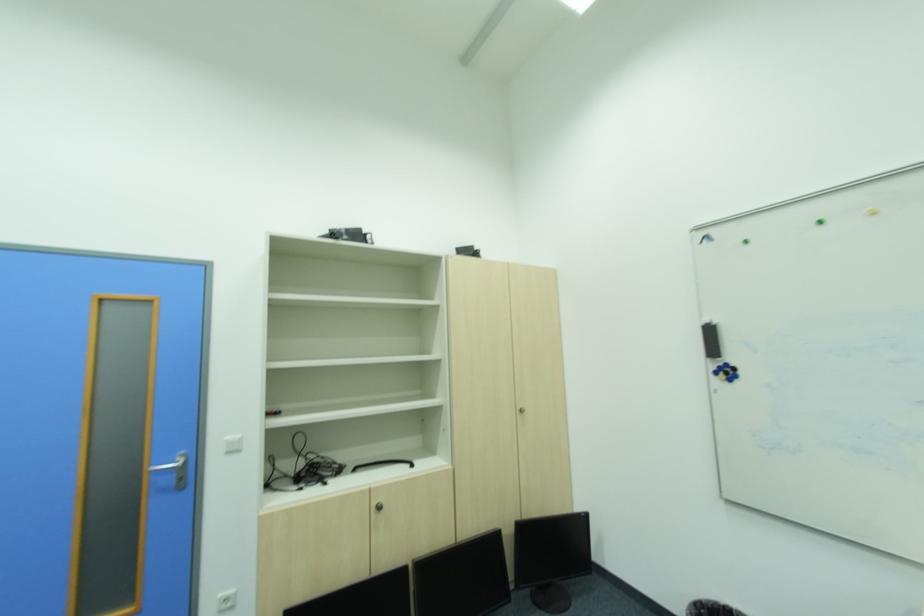
Where is `black whiteboard eraser`? This screenshot has width=924, height=616. black whiteboard eraser is located at coordinates (711, 339).